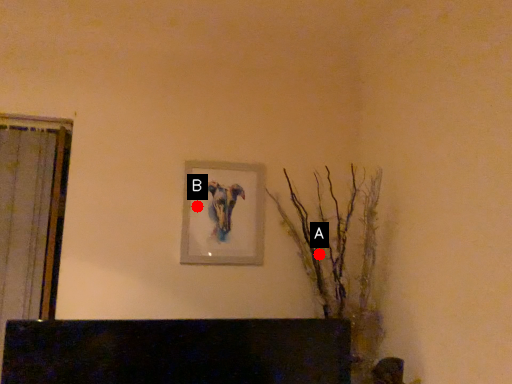
Question: Two points are circled on the image, labeled by A and B beside each circle. Among these points, which one is nearest to the camera?

Choices:
 (A) A is closer
 (B) B is closer

Answer: (B)